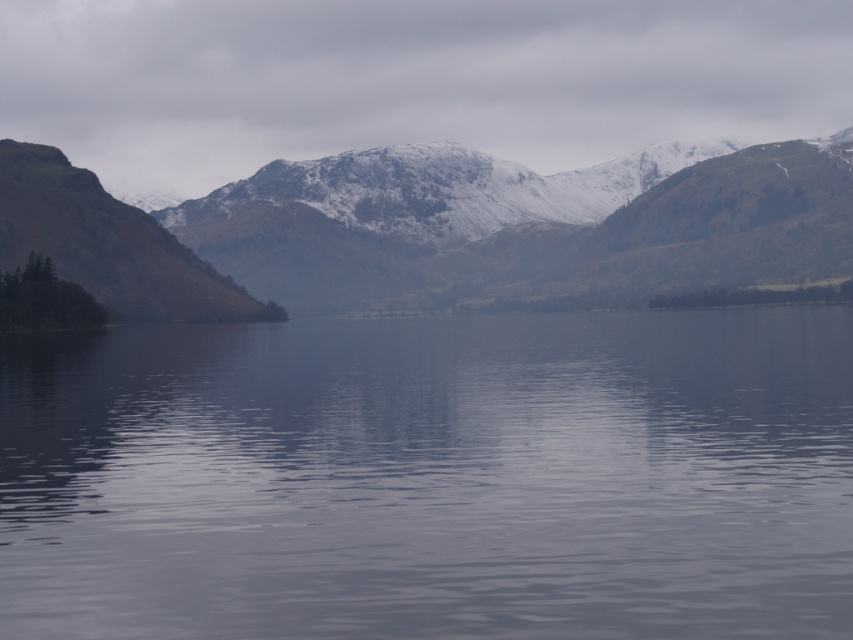
You are standing on the shore of the serene landscape and want to locate the smooth gray water at center. According to the coordinates provided, in which direction should you look to find it?

The smooth gray water at center is located at coordinates point (431, 476), so you should look towards the center of the image to find it.

You are standing at the edge of the smooth gray water at center and want to throw a stone to hit a target 300 meters away. Will the stone reach the target?

The smooth gray water at center is 316.25 meters away from the target, so yes, the stone can reach the target since the distance is within the stone throwing range.